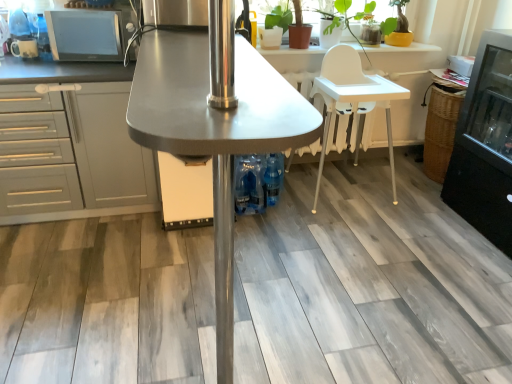
I want to click on free point to the right of metallic gray table at center, the 1th table viewed from the front, so click(x=365, y=299).